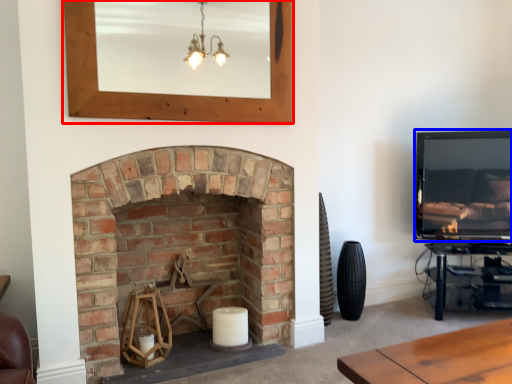
Question: Among these objects, which one is farthest to the camera, picture frame (highlighted by a red box) or television (highlighted by a blue box)?

Choices:
 (A) picture frame
 (B) television

Answer: (B)